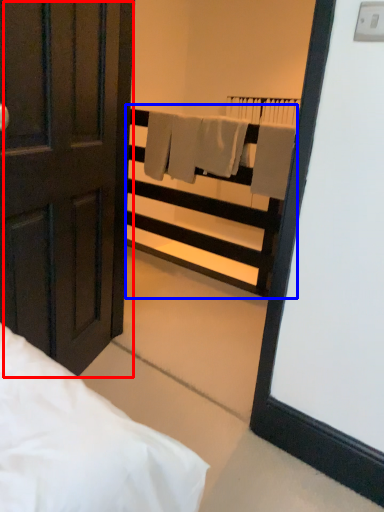
Question: Which point is further to the camera, door (highlighted by a red box) or balustrade (highlighted by a blue box)?

Choices:
 (A) door
 (B) balustrade

Answer: (B)